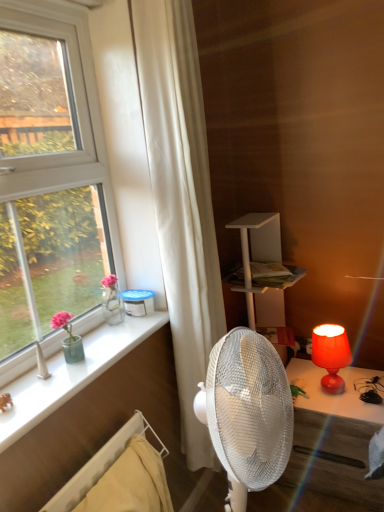
In order to click on empty space that is ontop of matte red lamp at right in this screenshot , I will do `click(326, 328)`.